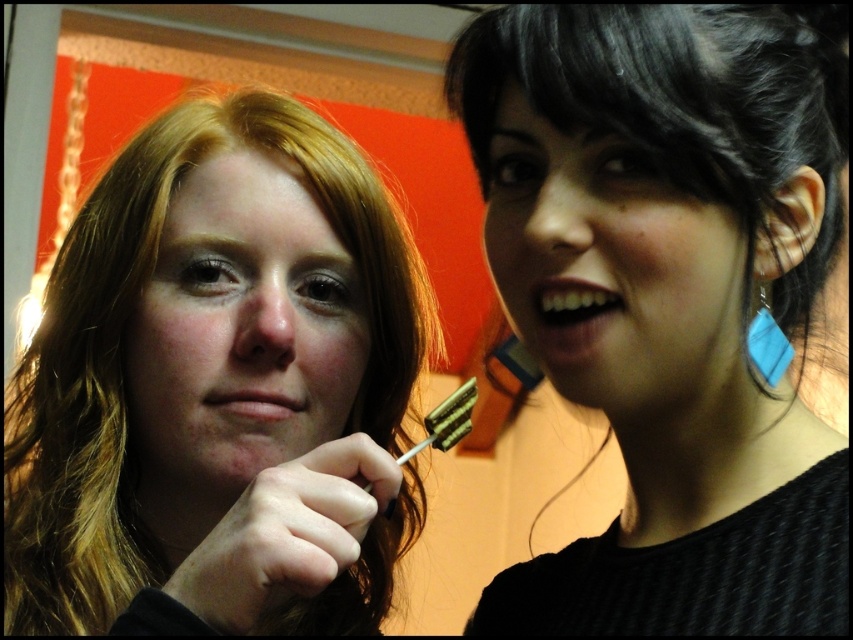
Question: Considering the real-world distances, which object is closest to the blue fabric earring at right?

Choices:
 (A) matte black hair at left
 (B) black matte hair at upper right

Answer: (B)

Question: Does matte skin face at center appear on the left side of white glossy teeth at upper right?

Choices:
 (A) no
 (B) yes

Answer: (B)

Question: Which object appears farthest from the camera in this image?

Choices:
 (A) blue fabric earring at right
 (B) matte black hair at left

Answer: (A)

Question: Can you confirm if black matte hair at upper right is positioned to the right of matte black hair at upper right?

Choices:
 (A) no
 (B) yes

Answer: (B)

Question: Which is nearer to the matte skin face at center?

Choices:
 (A) white glossy teeth at upper right
 (B) black matte hair at upper right
 (C) blue fabric earring at right

Answer: (B)

Question: Is matte skin face at center thinner than white glossy teeth at upper right?

Choices:
 (A) yes
 (B) no

Answer: (B)